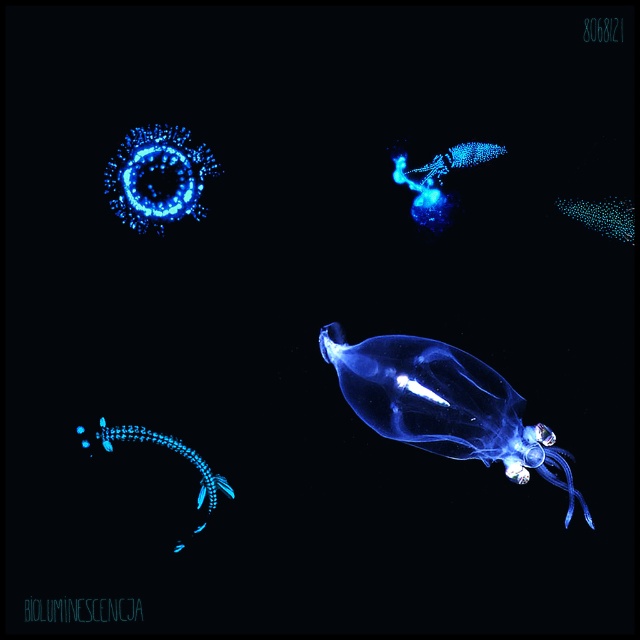
Question: Among these objects, which one is farthest from the camera?

Choices:
 (A) glowing blue translucent jellyfish at bottom left
 (B) transparent gelatinous at center

Answer: (A)

Question: Which point appears farthest from the camera in this image?

Choices:
 (A) (204, 490)
 (B) (426, 445)

Answer: (B)

Question: Among these objects, which one is farthest from the camera?

Choices:
 (A) transparent gelatinous at center
 (B) glowing blue translucent jellyfish at bottom left

Answer: (B)

Question: Does transparent gelatinous at center appear on the right side of glowing blue translucent jellyfish at bottom left?

Choices:
 (A) no
 (B) yes

Answer: (B)

Question: Is transparent gelatinous at center below glowing blue translucent jellyfish at bottom left?

Choices:
 (A) no
 (B) yes

Answer: (A)

Question: Does transparent gelatinous at center appear on the left side of glowing blue translucent jellyfish at bottom left?

Choices:
 (A) yes
 (B) no

Answer: (B)